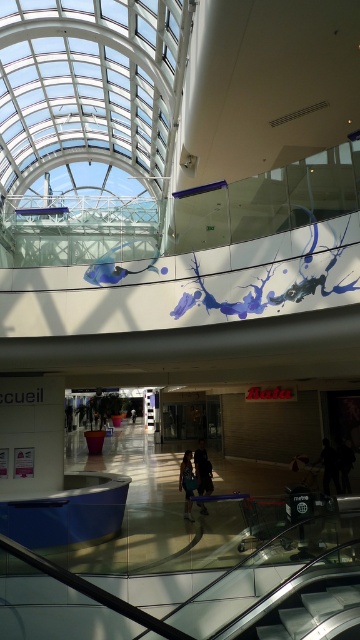
You are standing in the modern shopping mall and looking up at the decorative mural on the upper level. You notice two points marked on the ceiling. Which point is closer to you, point (210, 481) or point (191, 486)?

Point (210, 481) is closer to you because it is further to the viewer than point (191, 486).

You are standing in the shopping mall and see two pairs of jeans displayed at the center. The dark blue jeans at center and the blue denim jeans at center. Which pair is closer to the ground?

The dark blue jeans at center is below blue denim jeans at center, so the dark blue jeans at center is closer to the ground.